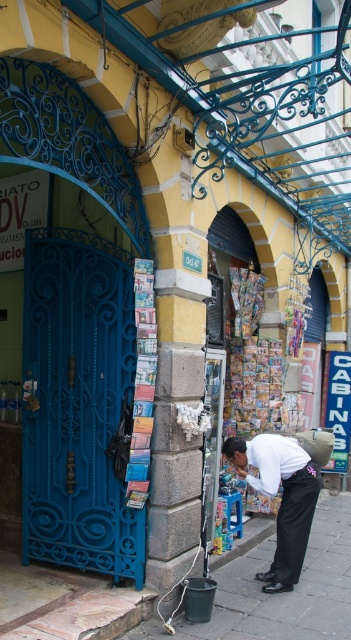
Is smooth concrete pavement at lower center bigger than white cotton shirt at center?

No.

Is smooth concrete pavement at lower center taller than white cotton shirt at center?

In fact, smooth concrete pavement at lower center may be shorter than white cotton shirt at center.

Which is in front, point (233, 577) or point (259, 449)?

Point (259, 449) is in front.

Identify the location of smooth concrete pavement at lower center. This screenshot has width=351, height=640. (281, 595).

Does point (288, 545) come farther from viewer compared to point (237, 497)?

No, it is not.

Is white cotton shirt at center smaller than blue plastic stool at lower center?

No, white cotton shirt at center is not smaller than blue plastic stool at lower center.

At what (x,y) coordinates should I click in order to perform the action: click on white cotton shirt at center. Please return your answer as a coordinate pair (x, y). The image size is (351, 640). Looking at the image, I should click on (281, 497).

Between smooth concrete pavement at lower center and blue plastic stool at lower center, which one has more height?

With more height is blue plastic stool at lower center.

Looking at this image, which is more to the left, smooth concrete pavement at lower center or blue plastic stool at lower center?

blue plastic stool at lower center

The height and width of the screenshot is (640, 351). Find the location of `smooth concrete pavement at lower center`. smooth concrete pavement at lower center is located at coordinates (281, 595).